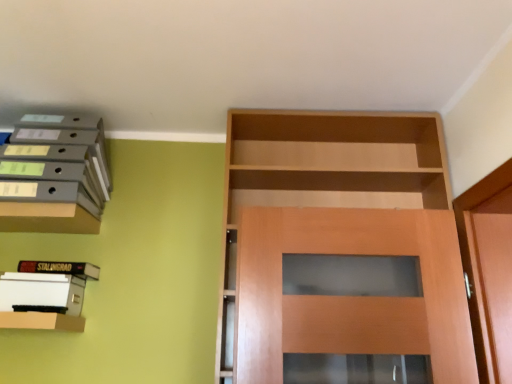
Question: Relative to hardcover book at upper left, which appears as the 1th book when viewed from the top, is matte gray folders at upper left, which is counted as the 1th shelf, starting from the top, in front or behind?

Choices:
 (A) front
 (B) behind

Answer: (A)

Question: From a real-world perspective, is matte gray folders at upper left, which is counted as the 1th shelf, starting from the top, above or below hardcover book at upper left, placed as the 2th book when sorted from bottom to top?

Choices:
 (A) below
 (B) above

Answer: (B)

Question: Considering the real-world distances, which object is closest to the hardcover book at upper left, placed as the 2th book when sorted from bottom to top?

Choices:
 (A) matte wood shelf at lower left, the second shelf positioned from the top
 (B) white paper at left, which ranks as the 1th book in bottom-to-top order
 (C) matte wood shelf at upper left
 (D) matte gray folders at upper left, which is counted as the 1th shelf, starting from the top

Answer: (B)

Question: Which object is positioned farthest from the white paper at left, which ranks as the 1th book in bottom-to-top order?

Choices:
 (A) matte wood shelf at upper left
 (B) matte wood shelf at lower left, the second shelf positioned from the top
 (C) matte gray folders at upper left, which is counted as the 1th shelf, starting from the top
 (D) hardcover book at upper left, which appears as the 1th book when viewed from the top

Answer: (C)